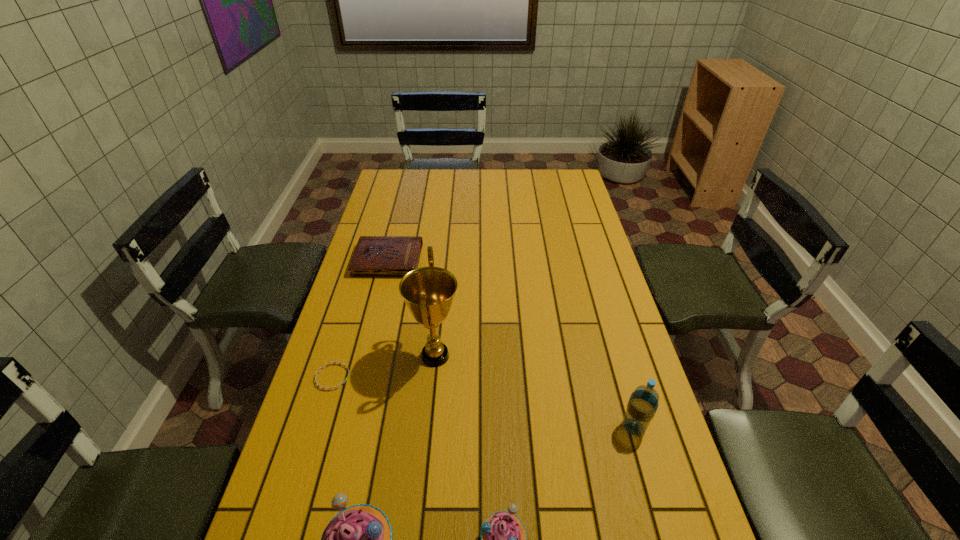
Image resolution: width=960 pixels, height=540 pixels. What are the coordinates of `free area in between the shortest object and the award` in the screenshot? It's located at (384, 367).

You are a GUI agent. You are given a task and a screenshot of the screen. Output one action in this format:
    pyautogui.click(x=<x>, y=<y>)
    Task: Click on the object that stands as the fifth closest to the tallest object
    
    Given the screenshot: What is the action you would take?
    pyautogui.click(x=643, y=403)

Identify which object is located as the fifth nearest to the water bottle. Please provide its 2D coordinates. Your answer should be formatted as a tuple, i.e. [(x, y)], where the tuple contains the x and y coordinates of a point satisfying the conditions above.

[(375, 256)]

You are a GUI agent. You are given a task and a screenshot of the screen. Output one action in this format:
    pyautogui.click(x=<x>, y=<y>)
    Task: Click on the vacant space that satisfies the following two spatial constraints: 1. on the back side of the rightmost object; 2. on the surface of the bracelet showing star-shaped elements
    The height and width of the screenshot is (540, 960).
    Given the screenshot: What is the action you would take?
    pyautogui.click(x=619, y=377)

You are a GUI agent. You are given a task and a screenshot of the screen. Output one action in this format:
    pyautogui.click(x=<x>, y=<y>)
    Task: Click on the free location that satisfies the following two spatial constraints: 1. on the surface of the water bottle showing star-shaped elements; 2. on the right side of the bracelet
    
    Given the screenshot: What is the action you would take?
    pyautogui.click(x=317, y=427)

The width and height of the screenshot is (960, 540). I want to click on vacant space that satisfies the following two spatial constraints: 1. on the front view with handles of the tallest object; 2. on the left side of the fourth farthest object, so click(x=428, y=427).